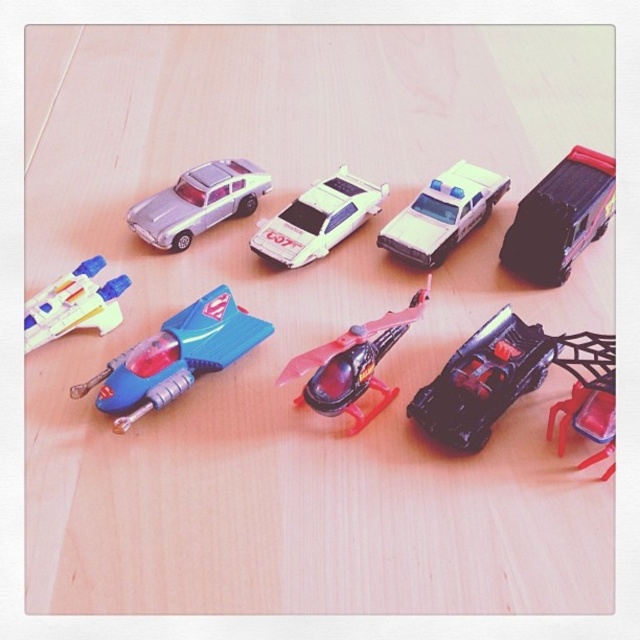
Looking at this image, does blue plastic spaceship at center-left appear on the left side of metallic silver car at upper left?

Correct, you'll find blue plastic spaceship at center-left to the left of metallic silver car at upper left.

Is point (241, 312) farther from camera compared to point (202, 211)?

No, (241, 312) is in front of (202, 211).

Is point (202, 364) less distant than point (189, 202)?

Yes.

The width and height of the screenshot is (640, 640). I want to click on blue plastic spaceship at center-left, so click(176, 356).

Is white glossy police car at center bigger than white glossy car at center?

Yes, white glossy police car at center is bigger than white glossy car at center.

Image resolution: width=640 pixels, height=640 pixels. Identify the location of white glossy police car at center. (442, 212).

Is black plastic truck at upper right to the right of shiny black helicopter at center from the viewer's perspective?

Yes, black plastic truck at upper right is to the right of shiny black helicopter at center.

Can you confirm if black plastic truck at upper right is wider than shiny black helicopter at center?

No.

Is point (588, 211) positioned before point (289, 360)?

That is False.

Where is `black plastic truck at upper right`? black plastic truck at upper right is located at coordinates (561, 218).